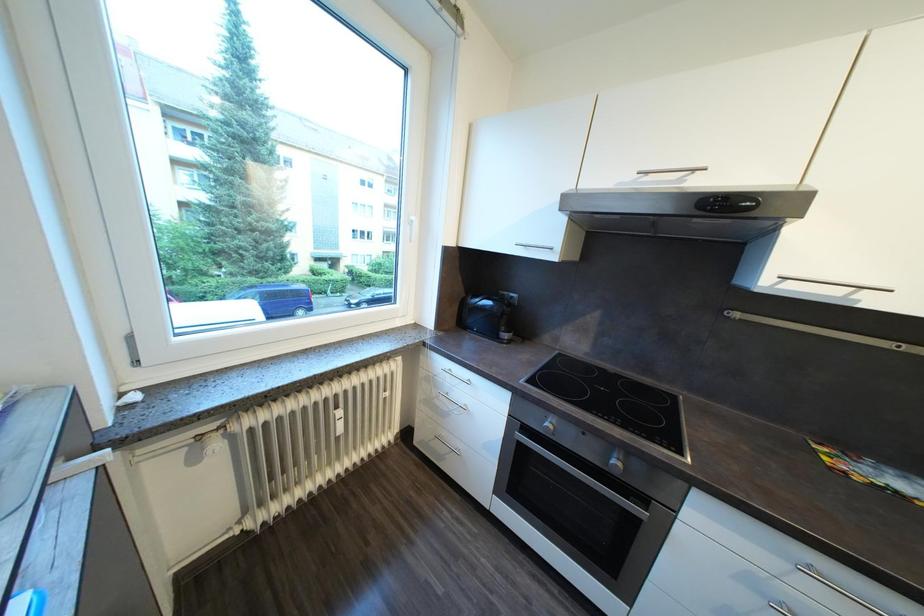
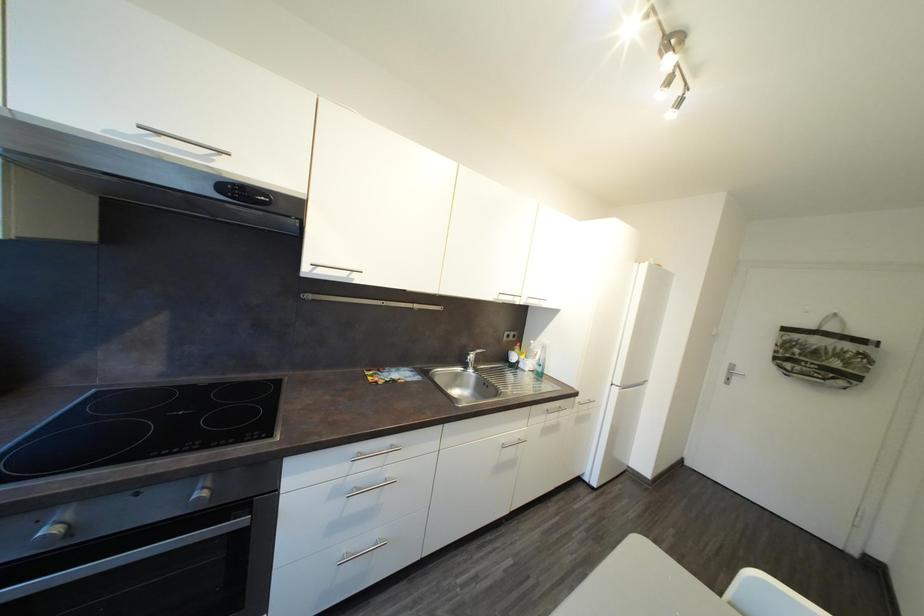
Question: The images are taken continuously from a first-person perspective. In which direction is your viewpoint rotating?

Choices:
 (A) Left
 (B) Right
 (C) Up
 (D) Down

Answer: (B)